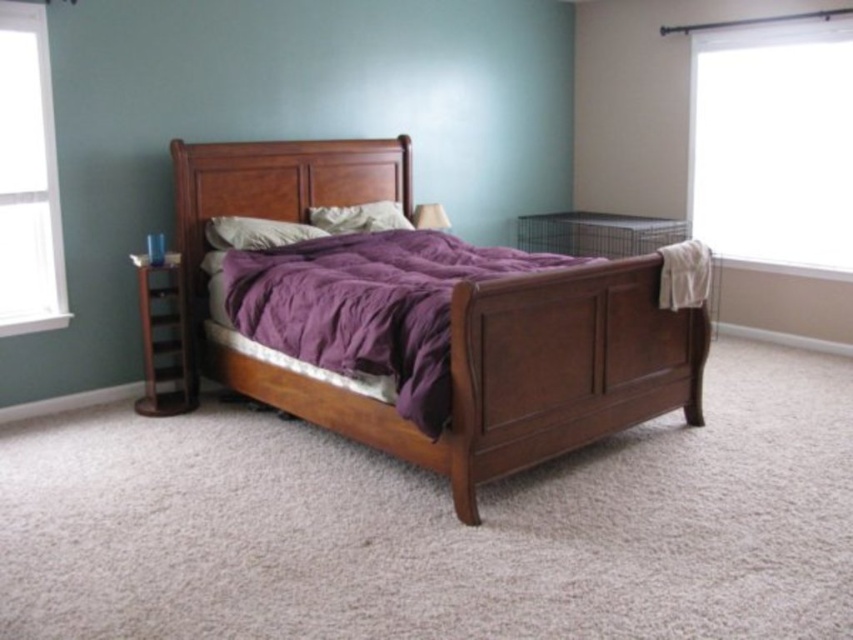
You are standing at the foot of the bed in the bedroom. You see two points marked as point 1 and point 2. Point 1 is at coordinates point (212, 200) and point 2 is at coordinates point (335, 225). Which point is closer to you?

Point 1 is closer to you because it is in front of point 2.

You are standing in the bedroom and want to place a new lamp on the bed. The bed is at the center of the room. Is the point at coordinates (454,324) on the bed?

Yes, the point at coordinates (454,324) is on the matte wood bed at center, so placing the lamp there would be appropriate.

You are arranging flowers in the bedroom and want to place a vase between the wooden headboard at center and the soft white pillow at center. Is this possible?

The wooden headboard at center is to the left of the soft white pillow at center, so there is space between them for placing a vase.